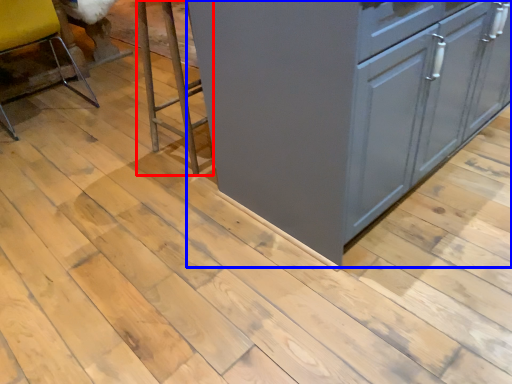
Question: Which object is closer to the camera taking this photo, step stool (highlighted by a red box) or cabinetry (highlighted by a blue box)?

Choices:
 (A) step stool
 (B) cabinetry

Answer: (B)